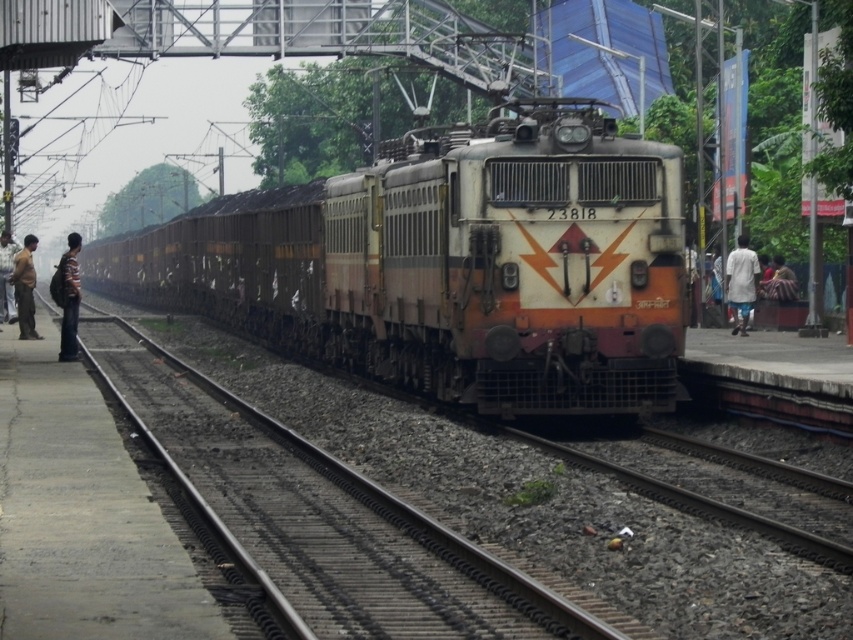
Who is more distant from viewer, (x=364, y=515) or (x=840, y=570)?

The point (x=364, y=515) is more distant.

Which is in front, point (204, 388) or point (820, 550)?

Point (820, 550) is more forward.

The height and width of the screenshot is (640, 853). Describe the element at coordinates (329, 516) in the screenshot. I see `brown gravel train track at center` at that location.

Image resolution: width=853 pixels, height=640 pixels. Find the location of `brown gravel train track at center`. brown gravel train track at center is located at coordinates (329, 516).

Is point (537, 262) closer to viewer compared to point (741, 317)?

Yes.

The height and width of the screenshot is (640, 853). Identify the location of orange metallic train at center. (451, 264).

Is gravel at center taller than light brown fabric shirt at left?

Incorrect, gravel at center's height is not larger of light brown fabric shirt at left's.

Who is shorter, gravel at center or light brown fabric shirt at left?

Standing shorter between the two is gravel at center.

Is point (721, 509) less distant than point (13, 308)?

Yes.

Where is `gravel at center`? The image size is (853, 640). gravel at center is located at coordinates (703, 504).